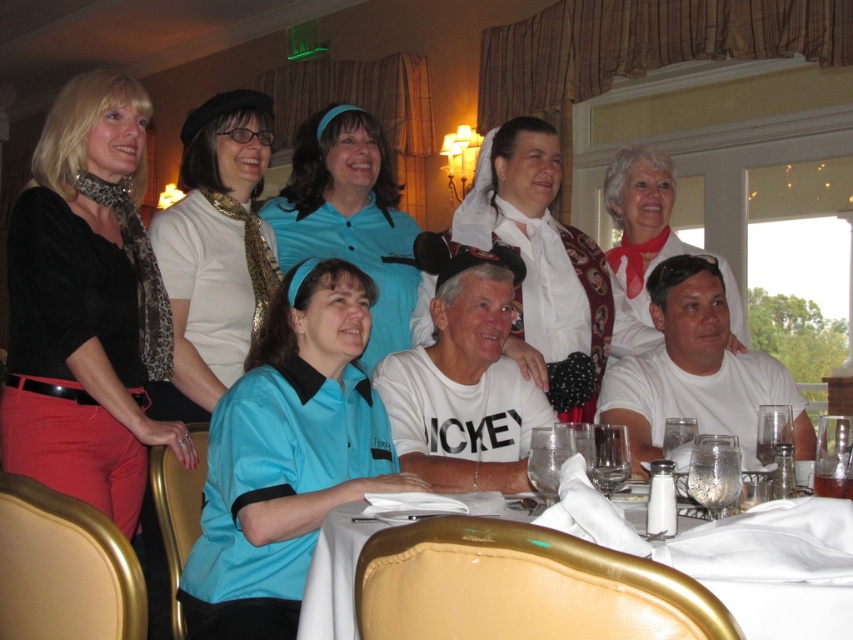
In the scene shown: You are a photographer standing in front of the dining table. You want to take a closeup shot of the white leopard print tie at upper left without moving any objects. Can you do it if your camera has a maximum zoom range of 2 meters?

The white leopard print tie at upper left is 2.71 meters away from viewer. Since the camera can only zoom up to 2 meters, the photographer cannot take a closeup shot without moving any objects.

You are a photographer standing behind the dining table. You want to take a photo of both the white satin dress at center and the matte white blouse at center. Can you fit both into your camera frame if your camera has a maximum capture width of 40 centimeters?

The distance between the white satin dress at center and the matte white blouse at center is 45.07 centimeters, which exceeds the camera frame width of 40 centimeters. Therefore, you cannot fit both into the frame.